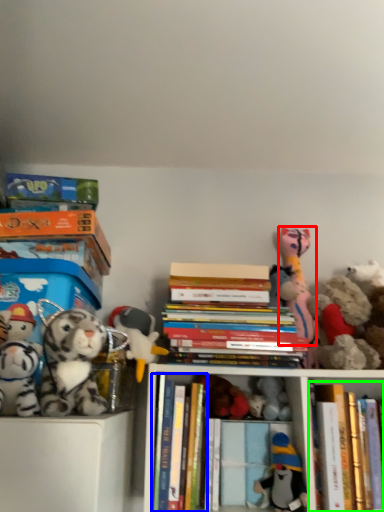
Question: Based on their relative distances, which object is farther from toy (highlighted by a red box)? Choose from book (highlighted by a blue box) and book (highlighted by a green box).

Choices:
 (A) book
 (B) book

Answer: (A)